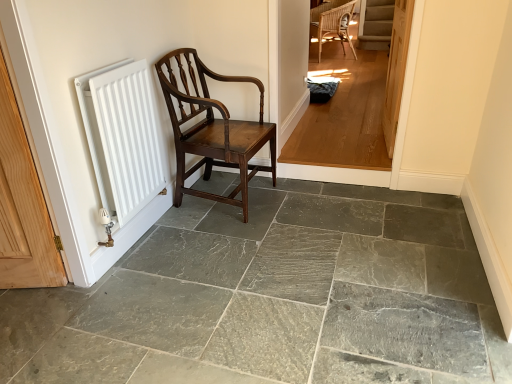
Where is `empty space that is to the right of polished dark wood chair at left`? The image size is (512, 384). empty space that is to the right of polished dark wood chair at left is located at coordinates (306, 203).